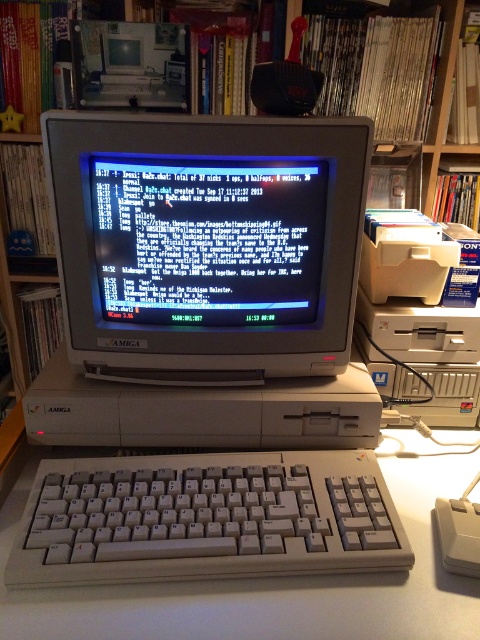
Question: Does white plastic monitor at center have a smaller size compared to white plastic mouse at lower right?

Choices:
 (A) no
 (B) yes

Answer: (A)

Question: Which point appears farthest from the camera in this image?

Choices:
 (A) (468, 512)
 (B) (349, 312)
 (C) (249, 257)

Answer: (B)

Question: Can you confirm if white plastic monitor at center is bigger than white plastic keyboard at lower center?

Choices:
 (A) no
 (B) yes

Answer: (B)

Question: Does white plastic monitor at center appear on the left side of white plastic mouse at lower right?

Choices:
 (A) no
 (B) yes

Answer: (B)

Question: Among these objects, which one is farthest from the camera?

Choices:
 (A) white plastic mouse at lower right
 (B) white plastic monitor at center
 (C) black matte monitor at center

Answer: (C)

Question: Which object appears farthest from the camera in this image?

Choices:
 (A) white plastic mouse at lower right
 (B) black matte monitor at center
 (C) white plastic keyboard at lower center
 (D) white plastic monitor at center

Answer: (B)